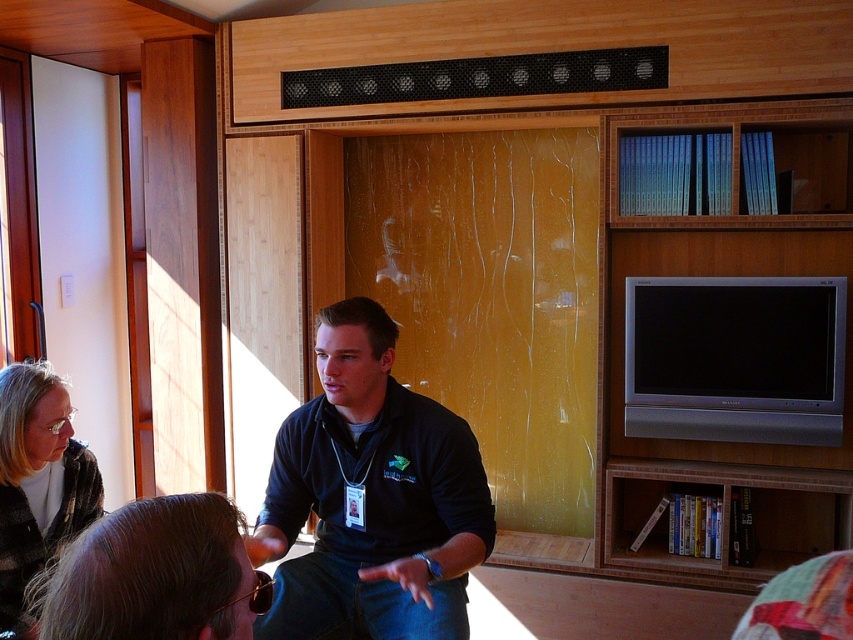
Question: Is brown hair at lower center thinner than matte black jacket at lower left?

Choices:
 (A) yes
 (B) no

Answer: (B)

Question: Where is black matte shirt at center located in relation to matte black jacket at lower left in the image?

Choices:
 (A) right
 (B) left

Answer: (A)

Question: Based on their relative distances, which object is nearer to the matte black jacket at lower left?

Choices:
 (A) brown hair at lower center
 (B) black matte shirt at center

Answer: (B)

Question: Which is farther from the matte black jacket at lower left?

Choices:
 (A) black matte shirt at center
 (B) brown hair at lower center

Answer: (B)

Question: Based on their relative distances, which object is farther from the matte black jacket at lower left?

Choices:
 (A) black matte shirt at center
 (B) brown hair at lower center

Answer: (B)

Question: Is black matte shirt at center thinner than brown hair at lower center?

Choices:
 (A) no
 (B) yes

Answer: (A)